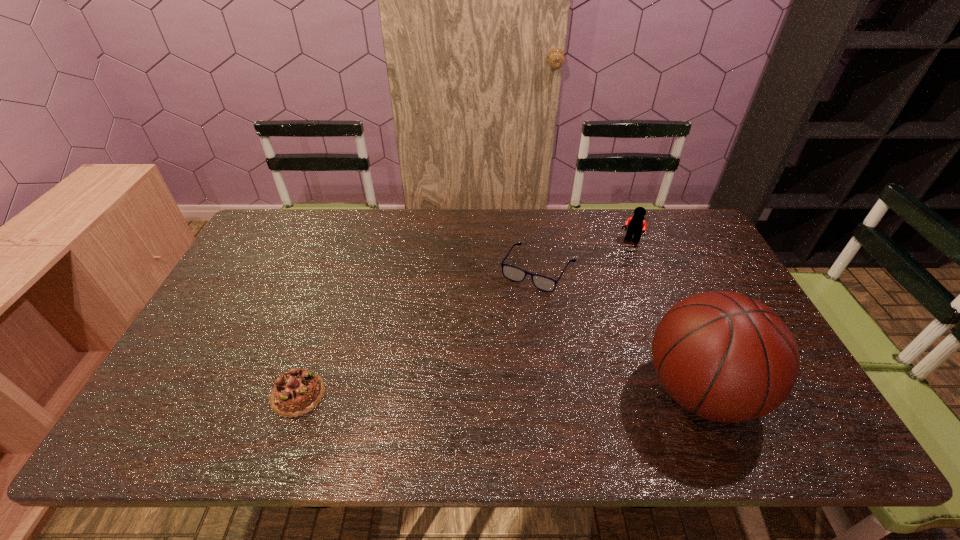
You are a GUI agent. You are given a task and a screenshot of the screen. Output one action in this format:
    pyautogui.click(x=<x>, y=<y>)
    Task: Click on the free space between the tallest object and the spectacles
    
    Given the screenshot: What is the action you would take?
    pyautogui.click(x=619, y=330)

Identify which object is the second nearest to the leftmost object. Please provide its 2D coordinates. Your answer should be formatted as a tuple, i.e. [(x, y)], where the tuple contains the x and y coordinates of a point satisfying the conditions above.

[(728, 358)]

Identify which object is the nearest to the Lego. Please provide its 2D coordinates. Your answer should be formatted as a tuple, i.e. [(x, y)], where the tuple contains the x and y coordinates of a point satisfying the conditions above.

[(513, 273)]

Where is `free space in the image that satisfies the following two spatial constraints: 1. on the back side of the second tallest object; 2. on the left side of the third object from right to left`? Image resolution: width=960 pixels, height=540 pixels. free space in the image that satisfies the following two spatial constraints: 1. on the back side of the second tallest object; 2. on the left side of the third object from right to left is located at coordinates (535, 241).

Where is `free spot that satisfies the following two spatial constraints: 1. on the back side of the spectacles; 2. on the right side of the leftmost object`? The height and width of the screenshot is (540, 960). free spot that satisfies the following two spatial constraints: 1. on the back side of the spectacles; 2. on the right side of the leftmost object is located at coordinates (341, 269).